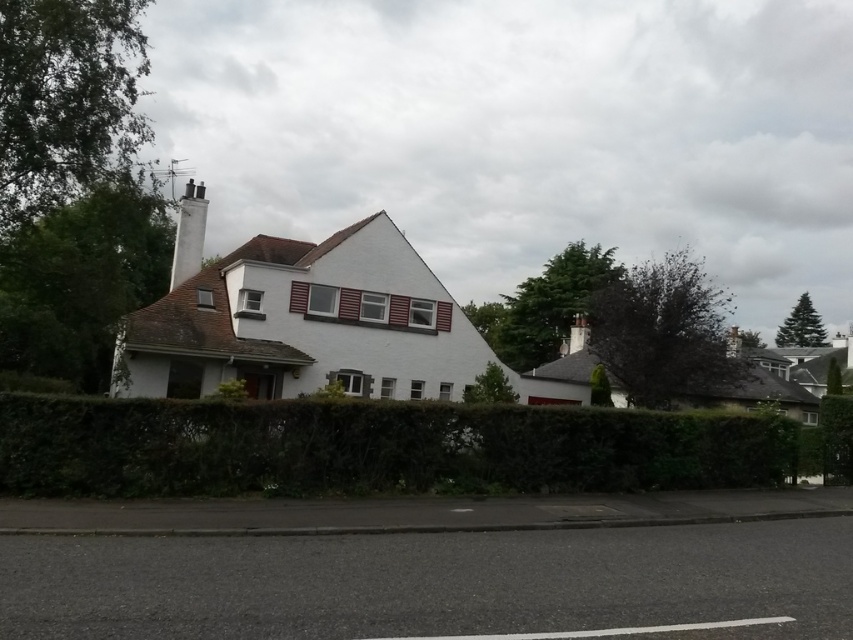
Question: Is green leafy hedge at lower center further to the viewer compared to white smooth chimney at upper center?

Choices:
 (A) no
 (B) yes

Answer: (A)

Question: Can you confirm if green leafy hedge at lower center is positioned to the left of white smooth chimney at upper center?

Choices:
 (A) yes
 (B) no

Answer: (B)

Question: Is green leafy hedge at lower center wider than white smooth chimney at upper center?

Choices:
 (A) yes
 (B) no

Answer: (A)

Question: Which object is closer to the camera taking this photo?

Choices:
 (A) green leafy hedge at lower center
 (B) white smooth chimney at upper center

Answer: (A)

Question: Which object appears farthest from the camera in this image?

Choices:
 (A) white smooth chimney at upper center
 (B) green leafy hedge at lower center

Answer: (A)

Question: Which of the following is the closest to the observer?

Choices:
 (A) white smooth chimney at upper center
 (B) green leafy hedge at lower center

Answer: (B)